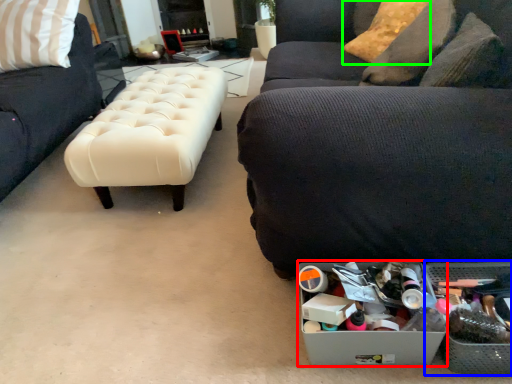
Question: Estimate the real-world distances between objects in this image. Which object is closer to storage box (highlighted by a red box), storage box (highlighted by a blue box) or pillow (highlighted by a green box)?

Choices:
 (A) storage box
 (B) pillow

Answer: (A)